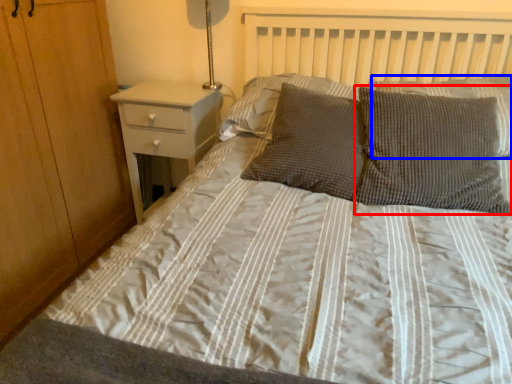
Question: Which object is closer to the camera taking this photo, pillow (highlighted by a red box) or pillow (highlighted by a blue box)?

Choices:
 (A) pillow
 (B) pillow

Answer: (A)